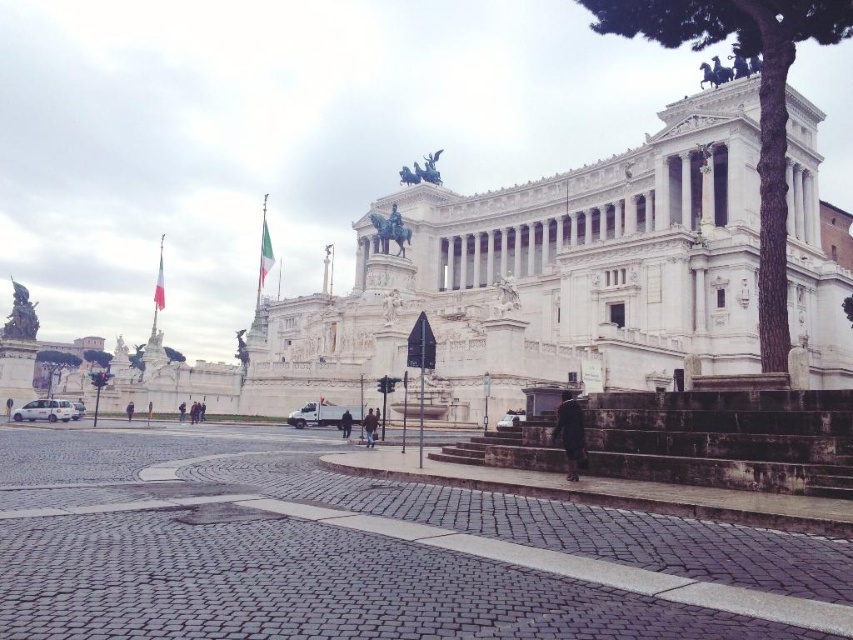
Question: Considering the real-world distances, which object is closest to the dark stone stairs at center?

Choices:
 (A) white marble palace at center
 (B) white matte van at lower left

Answer: (A)

Question: Does cobblestone plaza at center lie behind white matte van at center?

Choices:
 (A) no
 (B) yes

Answer: (A)

Question: Observing the image, what is the correct spatial positioning of white matte van at lower left in reference to white matte van at center?

Choices:
 (A) left
 (B) right

Answer: (A)

Question: Which object is the farthest from the white matte van at lower left?

Choices:
 (A) metallic silver car at lower center
 (B) dark stone stairs at center

Answer: (B)

Question: Which object is the farthest from the white matte van at center?

Choices:
 (A) cobblestone plaza at center
 (B) white matte van at lower left
 (C) metallic silver car at lower center

Answer: (A)

Question: From the image, what is the correct spatial relationship of white marble palace at center in relation to white matte van at lower left?

Choices:
 (A) above
 (B) below

Answer: (A)